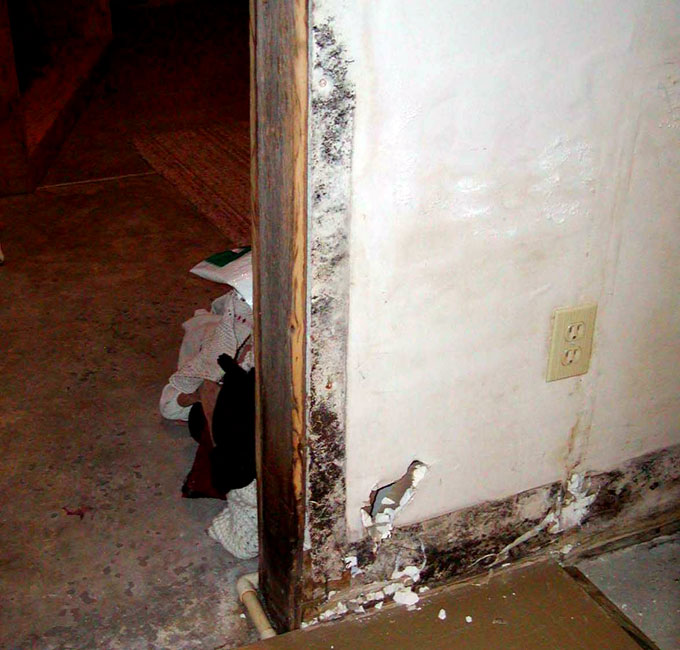
The width and height of the screenshot is (680, 650). Find the location of `spackle bumps`. spackle bumps is located at coordinates (564, 182), (579, 157), (596, 188), (668, 94).